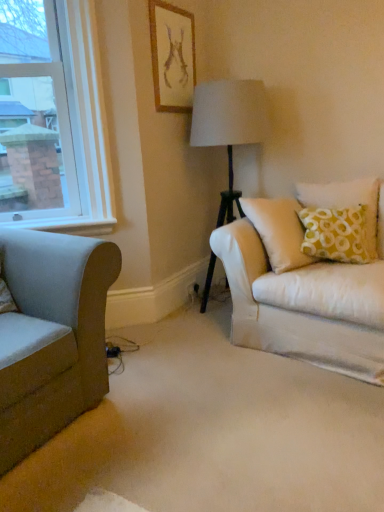
Question: Considering the relative positions of beige fabric carpet at center and white glass window at upper left in the image provided, is beige fabric carpet at center to the right of white glass window at upper left from the viewer's perspective?

Choices:
 (A) yes
 (B) no

Answer: (A)

Question: Does beige fabric carpet at center have a greater width compared to white glass window at upper left?

Choices:
 (A) yes
 (B) no

Answer: (A)

Question: From the image's perspective, is beige fabric carpet at center over white glass window at upper left?

Choices:
 (A) yes
 (B) no

Answer: (B)

Question: Does beige fabric carpet at center come in front of white glass window at upper left?

Choices:
 (A) no
 (B) yes

Answer: (B)

Question: Is beige fabric carpet at center taller than white glass window at upper left?

Choices:
 (A) no
 (B) yes

Answer: (A)

Question: Considering the positions of white glass window at upper left and beige fabric carpet at center in the image, is white glass window at upper left wider or thinner than beige fabric carpet at center?

Choices:
 (A) thin
 (B) wide

Answer: (A)

Question: From a real-world perspective, relative to beige fabric carpet at center, is white glass window at upper left vertically above or below?

Choices:
 (A) below
 (B) above

Answer: (B)

Question: Is white glass window at upper left in front of or behind beige fabric carpet at center in the image?

Choices:
 (A) front
 (B) behind

Answer: (B)

Question: In terms of height, does white glass window at upper left look taller or shorter compared to beige fabric carpet at center?

Choices:
 (A) short
 (B) tall

Answer: (B)

Question: From a real-world perspective, is matte gold picture frame at upper center physically located above or below beige fabric carpet at center?

Choices:
 (A) below
 (B) above

Answer: (B)

Question: Choose the correct answer: Is matte gold picture frame at upper center inside beige fabric carpet at center or outside it?

Choices:
 (A) outside
 (B) inside

Answer: (A)

Question: From the image's perspective, is matte gold picture frame at upper center located above or below beige fabric carpet at center?

Choices:
 (A) below
 (B) above

Answer: (B)

Question: Based on their sizes in the image, would you say matte gold picture frame at upper center is bigger or smaller than beige fabric carpet at center?

Choices:
 (A) big
 (B) small

Answer: (B)

Question: Considering the relative positions of yellow printed fabric pillow at right and beige fabric carpet at center in the image provided, is yellow printed fabric pillow at right to the left or to the right of beige fabric carpet at center?

Choices:
 (A) right
 (B) left

Answer: (A)

Question: Which is correct: yellow printed fabric pillow at right is inside beige fabric carpet at center, or outside of it?

Choices:
 (A) outside
 (B) inside

Answer: (A)